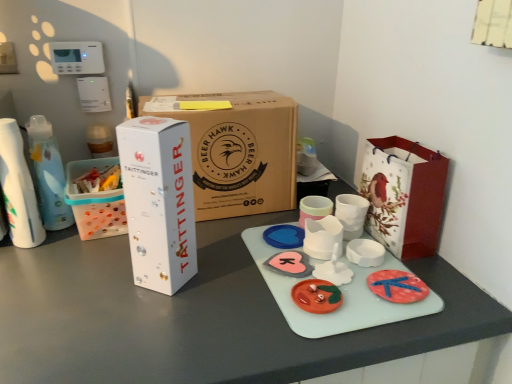
The image size is (512, 384). I want to click on free space to the left of white glossy cup at center, which is counted as the 3th toy, starting from the back, so click(x=240, y=277).